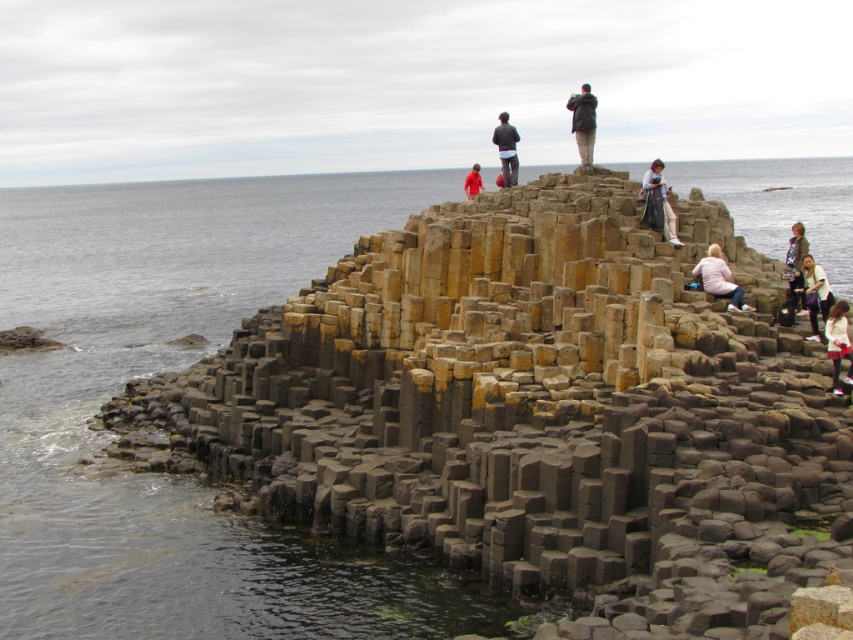
Can you confirm if matte gray jacket at upper center is positioned to the left of dark gray jacket at upper center?

In fact, matte gray jacket at upper center is to the right of dark gray jacket at upper center.

Which is behind, point (666, 209) or point (567, 102)?

The point (567, 102) is behind.

Describe the element at coordinates (659, 204) in the screenshot. I see `matte gray jacket at upper center` at that location.

Where is `matte gray jacket at upper center`? This screenshot has width=853, height=640. matte gray jacket at upper center is located at coordinates (659, 204).

Which is below, white cotton jacket at lower right or dark blue jacket at upper center?

Positioned lower is white cotton jacket at lower right.

Which is more to the right, white cotton jacket at lower right or dark blue jacket at upper center?

Answer: Positioned to the right is white cotton jacket at lower right.

Is point (834, 336) closer to camera compared to point (517, 132)?

Yes, point (834, 336) is closer to viewer.

The width and height of the screenshot is (853, 640). Identify the location of white cotton jacket at lower right. (838, 342).

Is point (708, 264) positioned before point (476, 164)?

That is True.

Does matte pink sweater at upper right appear over red fabric jacket at center?

Actually, matte pink sweater at upper right is below red fabric jacket at center.

Between point (704, 257) and point (466, 179), which one is positioned behind?

The point (466, 179) is behind.

Find the location of a particular element. The image size is (853, 640). matte pink sweater at upper right is located at coordinates (720, 280).